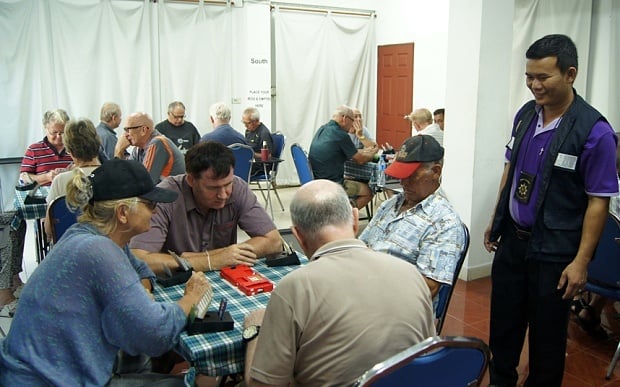
The height and width of the screenshot is (387, 620). I want to click on curtains, so click(319, 68), click(197, 55), click(100, 66).